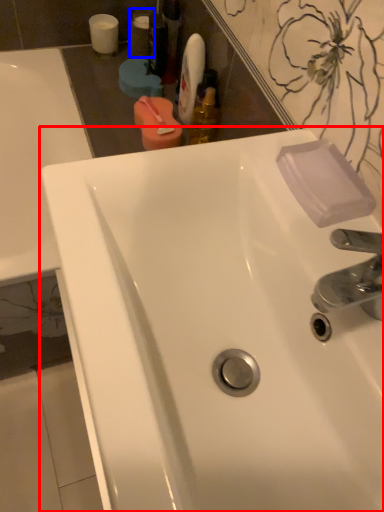
Question: Which object appears closest to the camera in this image, sink (highlighted by a red box) or mouthwash (highlighted by a blue box)?

Choices:
 (A) sink
 (B) mouthwash

Answer: (A)